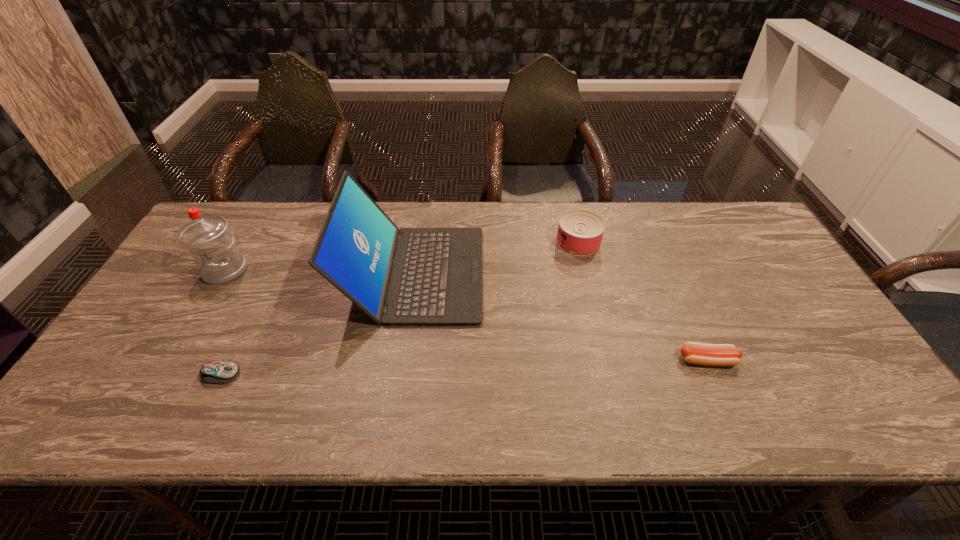
The width and height of the screenshot is (960, 540). I want to click on free space that satisfies the following two spatial constraints: 1. on the handle side of the leftmost object; 2. on the right side of the sausage, so click(x=173, y=360).

Locate an element on the screen. vacant position in the image that satisfies the following two spatial constraints: 1. on the handle side of the sausage; 2. on the right side of the water bottle is located at coordinates (173, 360).

Identify the location of vacant point that satisfies the following two spatial constraints: 1. on the front side of the sausage; 2. on the right side of the third tallest object. (607, 360).

This screenshot has height=540, width=960. I want to click on vacant space that satisfies the following two spatial constraints: 1. on the screen of the fourth tallest object; 2. on the right side of the third object from right to left, so click(x=401, y=360).